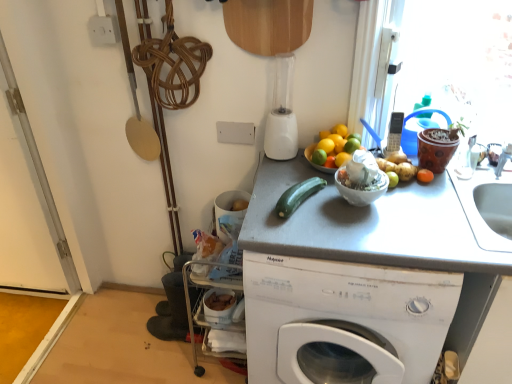
Locate an element on the screen. This screenshot has width=512, height=384. vacant area in front of green matte lime at center, placed as the second lime when sorted from right to left is located at coordinates (325, 202).